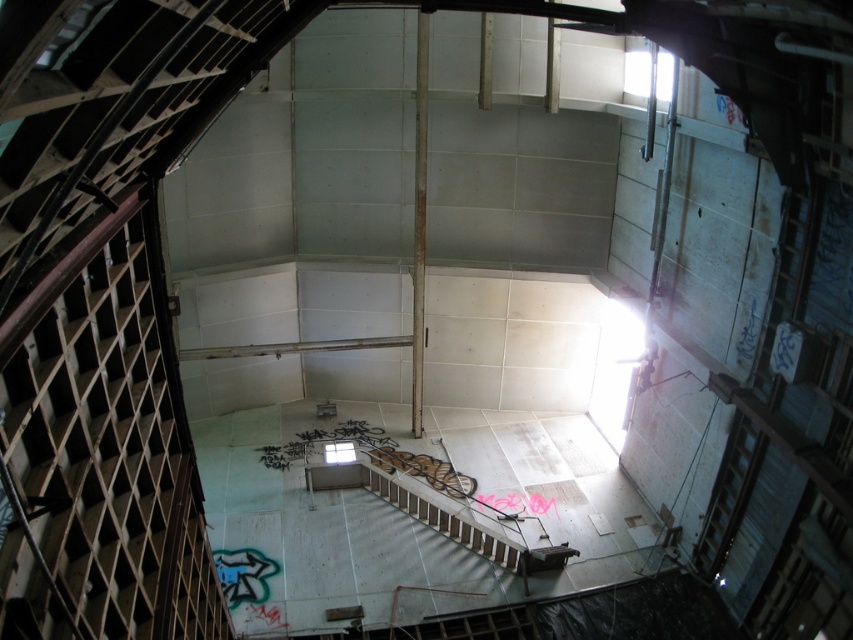
Is wooden at left smaller than white concrete stairs at center?

No.

Between point (65, 280) and point (473, 544), which one is positioned in front?

Point (65, 280)

The width and height of the screenshot is (853, 640). Find the location of `wooden at left`. wooden at left is located at coordinates (100, 448).